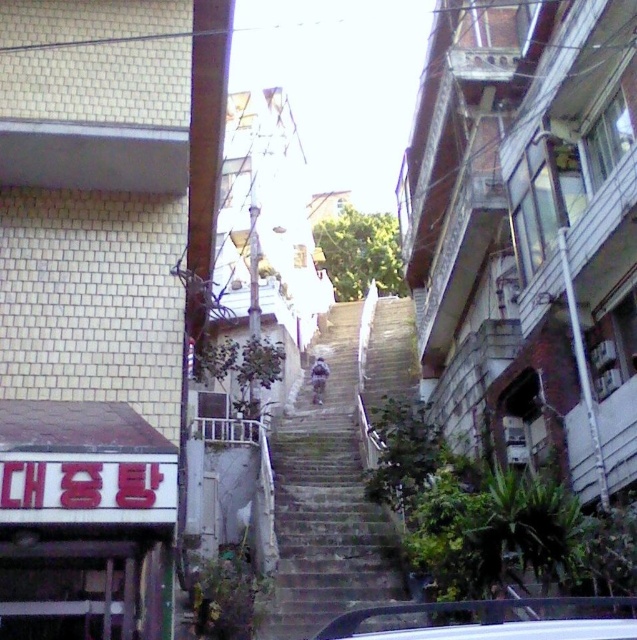
Question: Which point appears farthest from the camera in this image?

Choices:
 (A) (601, 602)
 (B) (313, 433)

Answer: (B)

Question: Is gray concrete stairs at center below white glossy car at center?

Choices:
 (A) yes
 (B) no

Answer: (A)

Question: Which point is closer to the camera?

Choices:
 (A) white glossy car at center
 (B) gray concrete stairs at center

Answer: (A)

Question: Does white glossy car at center appear under white plastic balustrade at center?

Choices:
 (A) yes
 (B) no

Answer: (B)

Question: Which of these objects is positioned farthest from the white plastic balustrade at center?

Choices:
 (A) gray concrete stairs at center
 (B) white glossy car at center

Answer: (B)

Question: Is gray concrete stairs at center below white plastic balustrade at center?

Choices:
 (A) yes
 (B) no

Answer: (A)